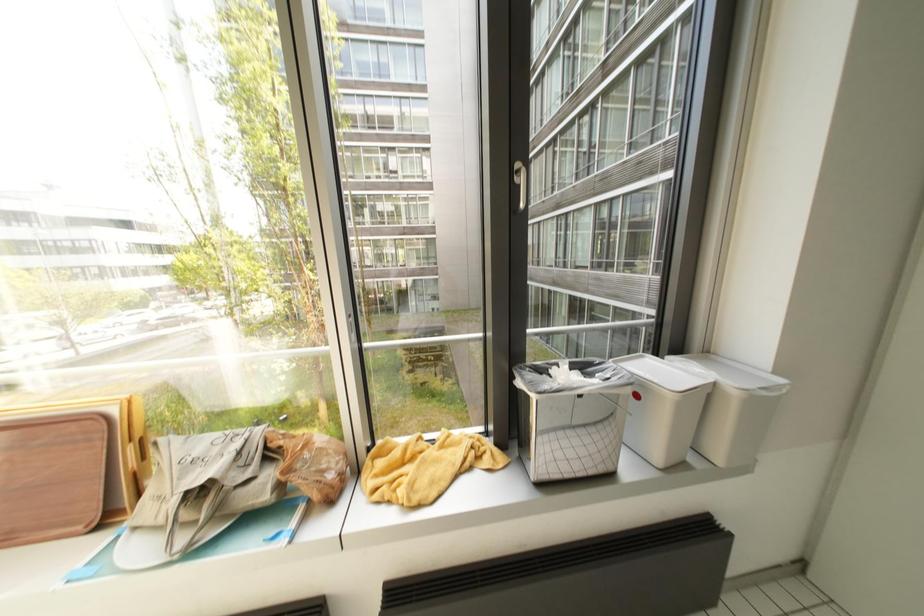
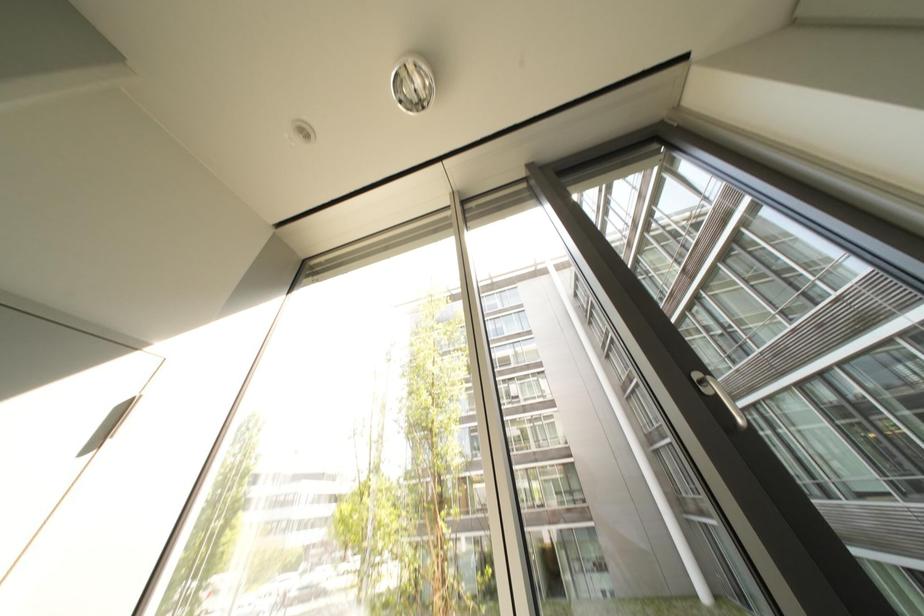
Based on the continuous images, in which direction is the camera rotating?

The rotation direction of the camera is left-up.